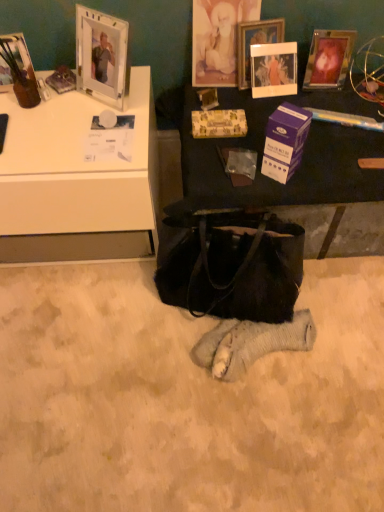
Locate an element on the screen. The image size is (384, 512). gold textured picture frame at upper center, which is the second picture frame in left-to-right order is located at coordinates (218, 39).

Find the location of a particular element. matte black table at center is located at coordinates (297, 172).

The width and height of the screenshot is (384, 512). I want to click on black leather handbag at center, so click(x=234, y=266).

What is the approximate width of white glossy desk at upper left?

white glossy desk at upper left is 21.34 inches in width.

You are a GUI agent. You are given a task and a screenshot of the screen. Output one action in this format:
    pyautogui.click(x=<x>, y=<y>)
    Task: Click on the clear plastic picture frame at upper center, the 3th picture frame viewed from the left
    The height and width of the screenshot is (512, 384).
    Given the screenshot: What is the action you would take?
    pyautogui.click(x=255, y=42)

Does point (87, 124) come farther from viewer compared to point (223, 115)?

No, it is not.

Between white glossy desk at upper left and gold-patterned paper at center, which one has larger width?

white glossy desk at upper left is wider.

Is white glossy desk at upper left oriented away from gold-patterned paper at center?

white glossy desk at upper left is not turned away from gold-patterned paper at center.

Can gold-patterned paper at center be found inside white glossy desk at upper left?

No, white glossy desk at upper left does not contain gold-patterned paper at center.

From the picture: Which is closer, (235, 54) or (276, 118)?

Point (235, 54).

Which of these two, gold textured picture frame at upper center, which is the second picture frame in left-to-right order, or purple cardboard box at center, stands shorter?

Standing shorter between the two is purple cardboard box at center.

Could you measure the distance between gold textured picture frame at upper center, which is the second picture frame in left-to-right order, and purple cardboard box at center?

gold textured picture frame at upper center, which is the second picture frame in left-to-right order, and purple cardboard box at center are 17.34 inches apart.

Could you tell me if gold textured picture frame at upper center, which is the second picture frame in left-to-right order, is facing purple cardboard box at center?

Yes.

How different are the orientations of clear plastic picture frame at upper center, which is the 2th picture frame from right to left, and gold-patterned paper at center in degrees?

There is a 2.84-degree angle between the facing directions of clear plastic picture frame at upper center, which is the 2th picture frame from right to left, and gold-patterned paper at center.

Considering the relative sizes of clear plastic picture frame at upper center, which is the 2th picture frame from right to left, and gold-patterned paper at center in the image provided, is clear plastic picture frame at upper center, which is the 2th picture frame from right to left, shorter than gold-patterned paper at center?

In fact, clear plastic picture frame at upper center, which is the 2th picture frame from right to left, may be taller than gold-patterned paper at center.

Could you tell me if clear plastic picture frame at upper center, the 3th picture frame viewed from the left, is facing gold-patterned paper at center?

Yes, clear plastic picture frame at upper center, the 3th picture frame viewed from the left, faces towards gold-patterned paper at center.

In the scene shown: Considering the sizes of objects clear plastic picture frame at upper center, which is the 2th picture frame from right to left, and gold-patterned paper at center in the image provided, who is bigger, clear plastic picture frame at upper center, which is the 2th picture frame from right to left, or gold-patterned paper at center?

clear plastic picture frame at upper center, which is the 2th picture frame from right to left.

Are matte glass picture frame at upper left, marked as the 4th picture frame in a right-to-left arrangement, and black leather handbag at center making contact?

No, matte glass picture frame at upper left, marked as the 4th picture frame in a right-to-left arrangement, is not with black leather handbag at center.

This screenshot has width=384, height=512. There is a black leather handbag at center. Find the location of `the 1st picture frame above it (from the image's perspective)`. the 1st picture frame above it (from the image's perspective) is located at coordinates (19, 53).

Is matte glass picture frame at upper left, placed as the first picture frame when sorted from left to right, looking in the opposite direction of black leather handbag at center?

No, matte glass picture frame at upper left, placed as the first picture frame when sorted from left to right, is not facing away from black leather handbag at center.

What's the angular difference between matte glass picture frame at upper left, placed as the first picture frame when sorted from left to right, and black leather handbag at center's facing directions?

20 degrees.

Which is more to the left, matte black table at center or matte glass picture frame at upper left, placed as the first picture frame when sorted from left to right?

Positioned to the left is matte glass picture frame at upper left, placed as the first picture frame when sorted from left to right.

Considering their positions, is matte black table at center located in front of or behind matte glass picture frame at upper left, marked as the 4th picture frame in a right-to-left arrangement?

matte black table at center is positioned closer to the viewer than matte glass picture frame at upper left, marked as the 4th picture frame in a right-to-left arrangement.

Is matte black table at center looking in the opposite direction of matte glass picture frame at upper left, placed as the first picture frame when sorted from left to right?

That's not correct — matte black table at center is not looking away from matte glass picture frame at upper left, placed as the first picture frame when sorted from left to right.

From a real-world perspective, is matte black table at center under matte glass picture frame at upper left, placed as the first picture frame when sorted from left to right?

Indeed, from a real-world perspective, matte black table at center is positioned beneath matte glass picture frame at upper left, placed as the first picture frame when sorted from left to right.

Are black leather handbag at center and clear plastic picture frame at upper center, which is the 2th picture frame from right to left, far apart?

No, black leather handbag at center is not far from clear plastic picture frame at upper center, which is the 2th picture frame from right to left.

From a real-world perspective, between black leather handbag at center and clear plastic picture frame at upper center, which is the 2th picture frame from right to left, who is vertically lower?

From a 3D spatial view, black leather handbag at center is below.

From the picture: Does black leather handbag at center turn towards clear plastic picture frame at upper center, which is the 2th picture frame from right to left?

No, black leather handbag at center is not turned towards clear plastic picture frame at upper center, which is the 2th picture frame from right to left.

From the image's perspective, which one is positioned higher, black leather handbag at center or clear plastic picture frame at upper center, the 3th picture frame viewed from the left?

clear plastic picture frame at upper center, the 3th picture frame viewed from the left, appears higher in the image.

Relative to gold-patterned paper at center, is matte glass picture frame at upper left, marked as the 4th picture frame in a right-to-left arrangement, in front or behind?

matte glass picture frame at upper left, marked as the 4th picture frame in a right-to-left arrangement, is in front of gold-patterned paper at center.

Is matte glass picture frame at upper left, placed as the first picture frame when sorted from left to right, facing towards gold-patterned paper at center?

No, matte glass picture frame at upper left, placed as the first picture frame when sorted from left to right, does not turn towards gold-patterned paper at center.

Does matte glass picture frame at upper left, marked as the 4th picture frame in a right-to-left arrangement, have a greater height compared to gold-patterned paper at center?

Yes, matte glass picture frame at upper left, marked as the 4th picture frame in a right-to-left arrangement, is taller than gold-patterned paper at center.

Is gold-patterned paper at center inside matte glass picture frame at upper left, marked as the 4th picture frame in a right-to-left arrangement?

No, gold-patterned paper at center is not a part of matte glass picture frame at upper left, marked as the 4th picture frame in a right-to-left arrangement.

Find the location of `paperback book above the white glossy desk at upper left (from a real-world perspective)`. paperback book above the white glossy desk at upper left (from a real-world perspective) is located at coordinates (219, 123).

Identify the location of box in front of the gold textured picture frame at upper center, acting as the 3th picture frame starting from the right. This screenshot has height=512, width=384. (285, 141).

From the image, which object appears to be nearer to matte glass picture frame at upper left, placed as the first picture frame when sorted from left to right, matte black table at center or gold-patterned paper at center?

gold-patterned paper at center.

When comparing their distances from metallic silver picture frame at upper right, marked as the 4th picture frame in a left-to-right arrangement, does matte glass picture frame at upper left, marked as the 4th picture frame in a right-to-left arrangement, or gold-patterned paper at center seem closer?

gold-patterned paper at center is positioned closer to the anchor metallic silver picture frame at upper right, marked as the 4th picture frame in a left-to-right arrangement.

Based on their spatial positions, is black leather handbag at center or metallic silver picture frame at upper right, marked as the 4th picture frame in a left-to-right arrangement, further from gold-patterned paper at center?

The object further to gold-patterned paper at center is black leather handbag at center.

Based on their spatial positions, is matte black table at center or matte glass picture frame at upper left, marked as the 4th picture frame in a right-to-left arrangement, further from metallic silver picture frame at upper right, marked as the 4th picture frame in a left-to-right arrangement?

matte glass picture frame at upper left, marked as the 4th picture frame in a right-to-left arrangement, lies further to metallic silver picture frame at upper right, marked as the 4th picture frame in a left-to-right arrangement, than the other object.

Looking at the image, which one is located further to white glossy desk at upper left, black leather handbag at center or gold-patterned paper at center?

The object further to white glossy desk at upper left is gold-patterned paper at center.

Considering their positions, is white glossy desk at upper left positioned closer to matte glass picture frame at upper left, marked as the 4th picture frame in a right-to-left arrangement, than purple cardboard box at center?

Based on the image, white glossy desk at upper left appears to be nearer to matte glass picture frame at upper left, marked as the 4th picture frame in a right-to-left arrangement.

Which object lies further to the anchor point white glossy desk at upper left, gold-patterned paper at center or clear plastic picture frame at upper center, which is the 2th picture frame from right to left?

Based on the image, clear plastic picture frame at upper center, which is the 2th picture frame from right to left, appears to be further to white glossy desk at upper left.

From the image, which object appears to be nearer to clear plastic picture frame at upper center, the 3th picture frame viewed from the left, matte glass picture frame at upper left, placed as the first picture frame when sorted from left to right, or matte black table at center?

matte black table at center is positioned closer to the anchor clear plastic picture frame at upper center, the 3th picture frame viewed from the left.

Locate an element on the screen. The width and height of the screenshot is (384, 512). paperback book between white glossy desk at upper left and black leather handbag at center from left to right is located at coordinates (219, 123).

Locate an element on the screen. desk between clear plastic picture frame at upper center, which is the 2th picture frame from right to left, and black leather handbag at center in the up-down direction is located at coordinates [77, 182].

Image resolution: width=384 pixels, height=512 pixels. What are the coordinates of `desk located between matte glass picture frame at upper left, marked as the 4th picture frame in a right-to-left arrangement, and clear plastic picture frame at upper center, which is the 2th picture frame from right to left, in the left-right direction` in the screenshot? It's located at (77, 182).

Locate an element on the screen. box between white glossy desk at upper left and matte black table at center from left to right is located at coordinates (285, 141).